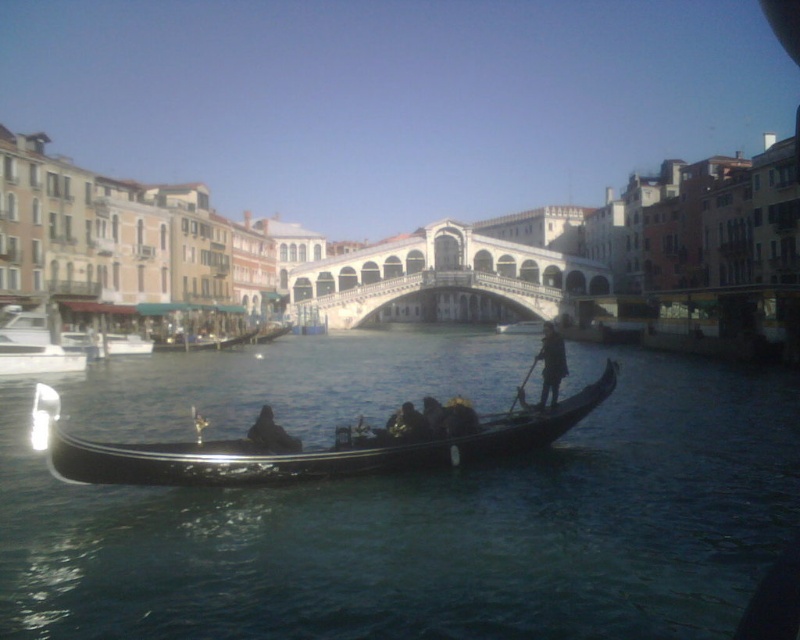
You are standing on the Rialto Bridge and see two points in the water below. The first point is labeled as point [484,445], and the second is point [542,392]. Which point is closer to you?

Point [484,445] is closer to the viewer than point [542,392].